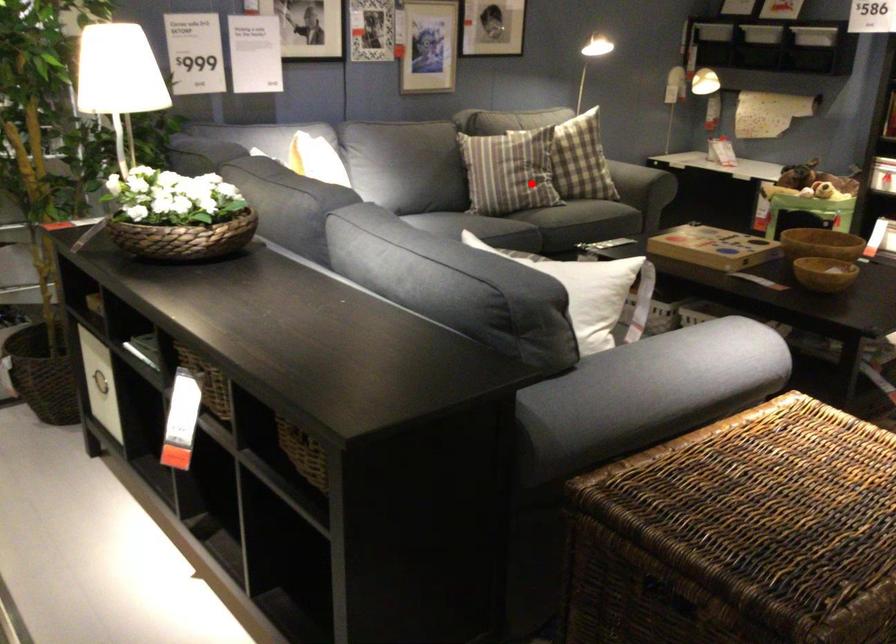
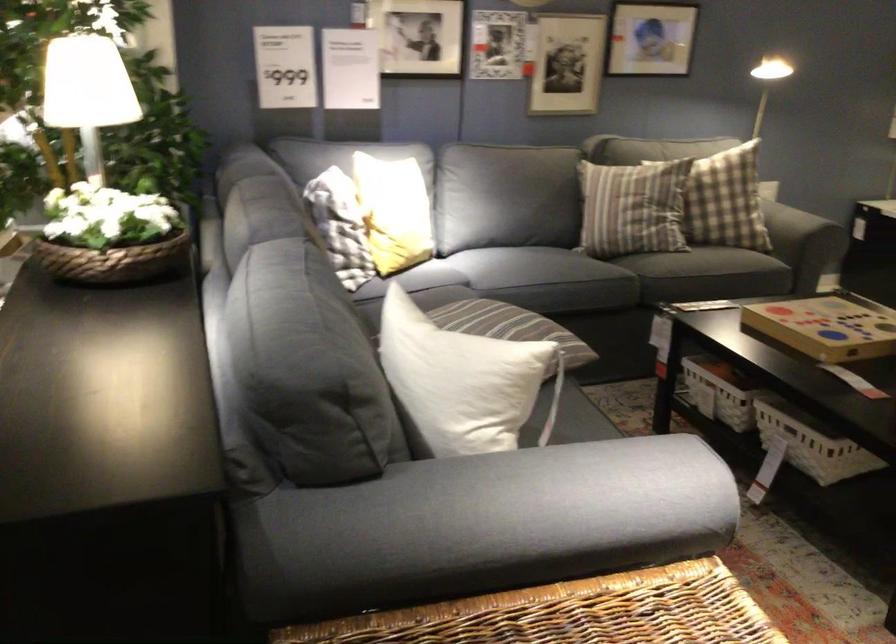
In the second image, find the point that corresponds to the highlighted location in the first image.

(633, 207)